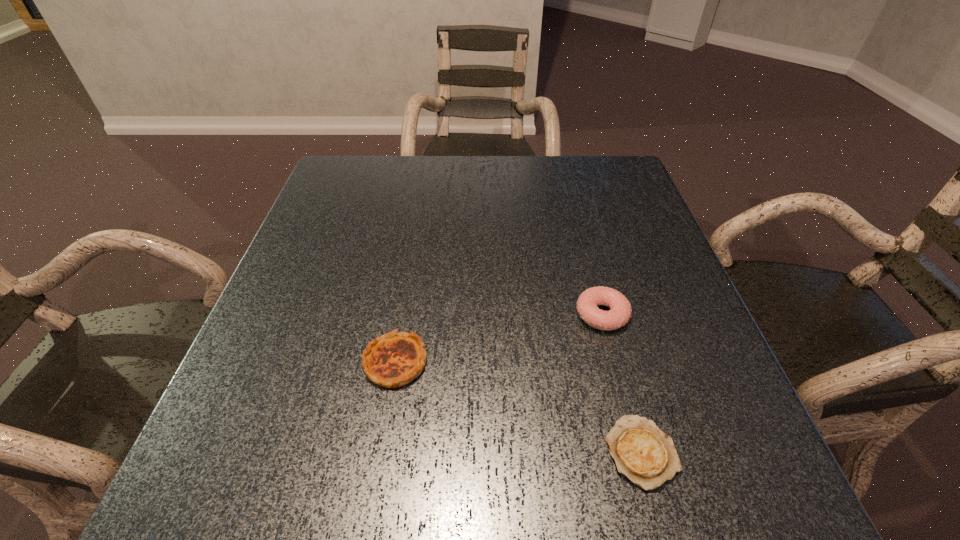
Identify which object is located as the second nearest to the farthest object. Please provide its 2D coordinates. Your answer should be formatted as a tuple, i.e. [(x, y)], where the tuple contains the x and y coordinates of a point satisfying the conditions above.

[(394, 359)]

The height and width of the screenshot is (540, 960). I want to click on vacant space that satisfies the following two spatial constraints: 1. on the front side of the farther quiche; 2. on the left side of the shorter quiche, so click(380, 451).

Locate an element on the screen. vacant area in the image that satisfies the following two spatial constraints: 1. on the front side of the farthest object; 2. on the left side of the nearest object is located at coordinates (637, 451).

This screenshot has width=960, height=540. Find the location of `vacant space that satisfies the following two spatial constraints: 1. on the front side of the farthest object; 2. on the left side of the nearest object`. vacant space that satisfies the following two spatial constraints: 1. on the front side of the farthest object; 2. on the left side of the nearest object is located at coordinates (637, 451).

Find the location of a particular element. The image size is (960, 540). free space that satisfies the following two spatial constraints: 1. on the front side of the nearest object; 2. on the right side of the leftmost object is located at coordinates (380, 451).